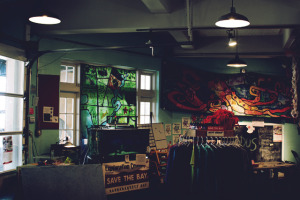
Image resolution: width=300 pixels, height=200 pixels. What are the coordinates of `stain glass window` in the screenshot? It's located at (112, 99).